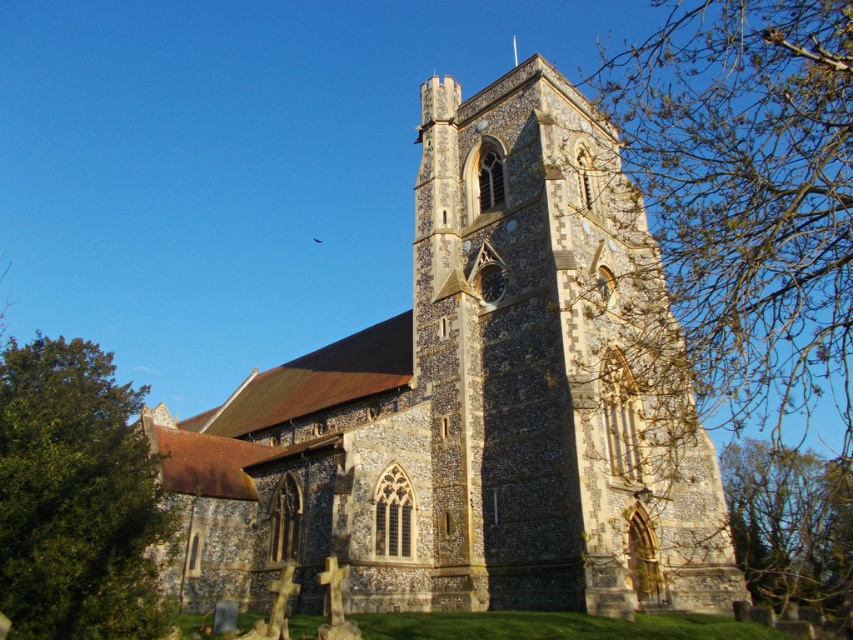
You are standing at the point marked as point (74, 497) in the image. Which object is directly in front of you?

The green leafy tree at lower left is located at point (74, 497), so the object directly in front of you is the green leafy tree at lower left.